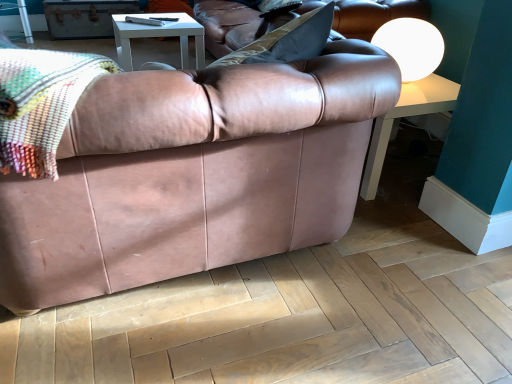
Question: From their relative heights in the image, would you say multicolored woven blanket at upper left is taller or shorter than white matte sphere at upper right?

Choices:
 (A) short
 (B) tall

Answer: (A)

Question: From a real-world perspective, is multicolored woven blanket at upper left above or below white matte sphere at upper right?

Choices:
 (A) above
 (B) below

Answer: (A)

Question: Estimate the real-world distances between objects in this image. Which object is farther from the light brown wood at lower center?

Choices:
 (A) matte brown leather couch at center
 (B) multicolored woven blanket at upper left
 (C) white matte sphere at upper right

Answer: (C)

Question: Estimate the real-world distances between objects in this image. Which object is closer to the white matte sphere at upper right?

Choices:
 (A) light brown wood at lower center
 (B) multicolored woven blanket at upper left
 (C) matte brown leather couch at center

Answer: (C)